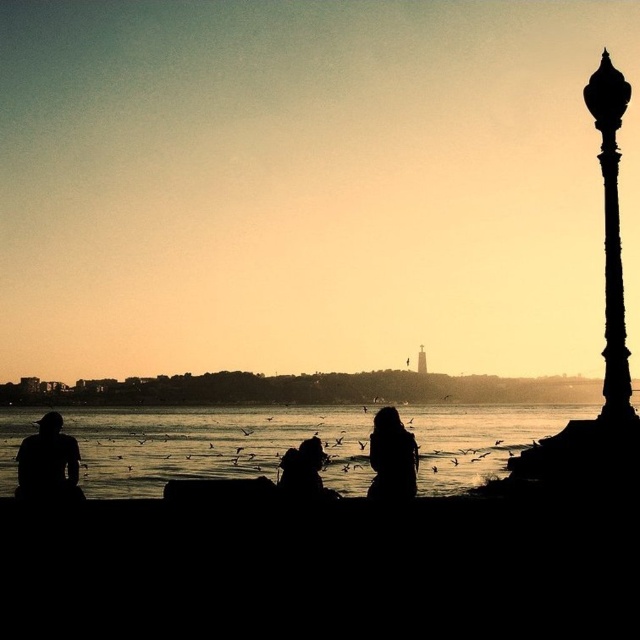
You are standing at the point marked as point (x=211, y=445) in the image. What is the terrain like at this location?

The terrain at point (x=211, y=445) is transparent water at lower center.

You are standing at the waterfront and see the transparent water at lower center and the silhouette hoodie at center. Which object is closer to the horizon?

The transparent water at lower center is above the silhouette hoodie at center, meaning the silhouette hoodie at center is closer to the horizon.

You are a delivery drone with a wingspan of 1.5 meters. You need to fly from the transparent water at lower center to the black polished metal lamp post at right. Is there enough space between them for you to pass safely?

The distance between the transparent water at lower center and the black polished metal lamp post at right is 48.82 meters, so yes, the drone can pass safely since the distance is much larger than its wingspan.